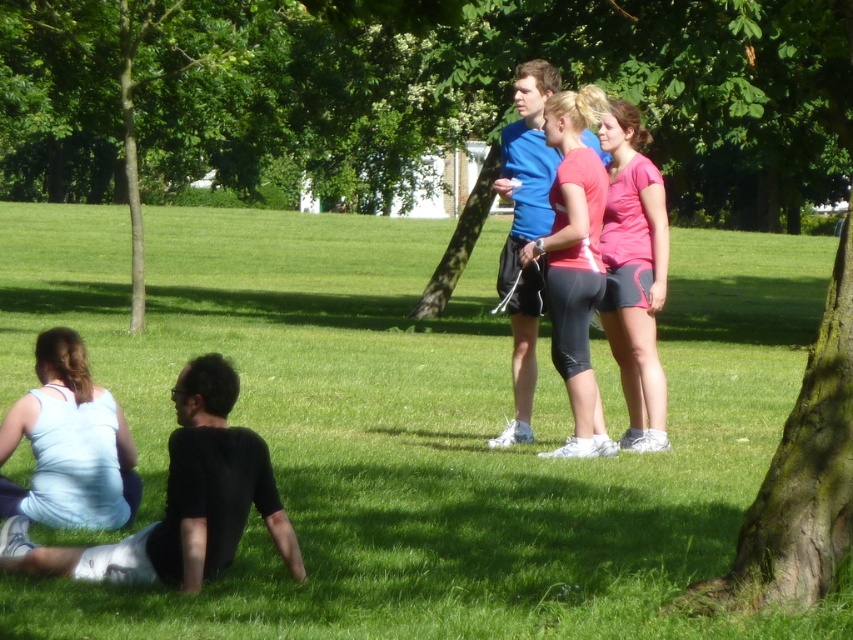
Does pink matte leggings at center have a greater width compared to pink fabric shorts at center?

Yes, pink matte leggings at center is wider than pink fabric shorts at center.

Which is more to the right, pink matte leggings at center or pink fabric shorts at center?

pink fabric shorts at center

The width and height of the screenshot is (853, 640). Describe the element at coordinates (573, 262) in the screenshot. I see `pink matte leggings at center` at that location.

Where is `pink matte leggings at center`? pink matte leggings at center is located at coordinates (573, 262).

Does point (251, 314) come farther from viewer compared to point (6, 426)?

Yes, point (251, 314) is farther from viewer.

Does green grassy at center have a greater width compared to light blue fabric at lower left?

Yes.

Which is behind, point (160, 595) or point (73, 472)?

The point (73, 472) is behind.

Locate an element on the screen. This screenshot has width=853, height=640. green grassy at center is located at coordinates (415, 426).

Can you confirm if green leafy tree at center is shorter than pink fabric shorts at center?

No.

Is point (113, 49) positioned before point (608, 116)?

No.

I want to click on green leafy tree at center, so click(x=413, y=93).

This screenshot has width=853, height=640. What are the coordinates of `green leafy tree at center` in the screenshot? It's located at (413, 93).